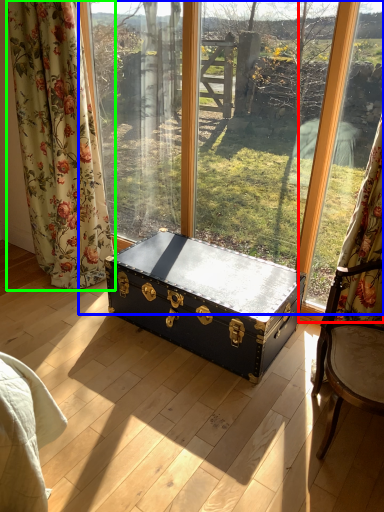
Question: Based on their relative distances, which object is nearer to window frame (highlighted by a red box)? Choose from window (highlighted by a blue box) and curtain (highlighted by a green box).

Choices:
 (A) window
 (B) curtain

Answer: (A)